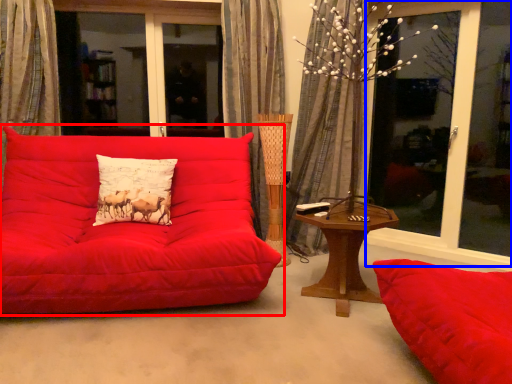
Question: Which object appears farthest to the camera in this image, studio couch (highlighted by a red box) or window screen (highlighted by a blue box)?

Choices:
 (A) studio couch
 (B) window screen

Answer: (B)